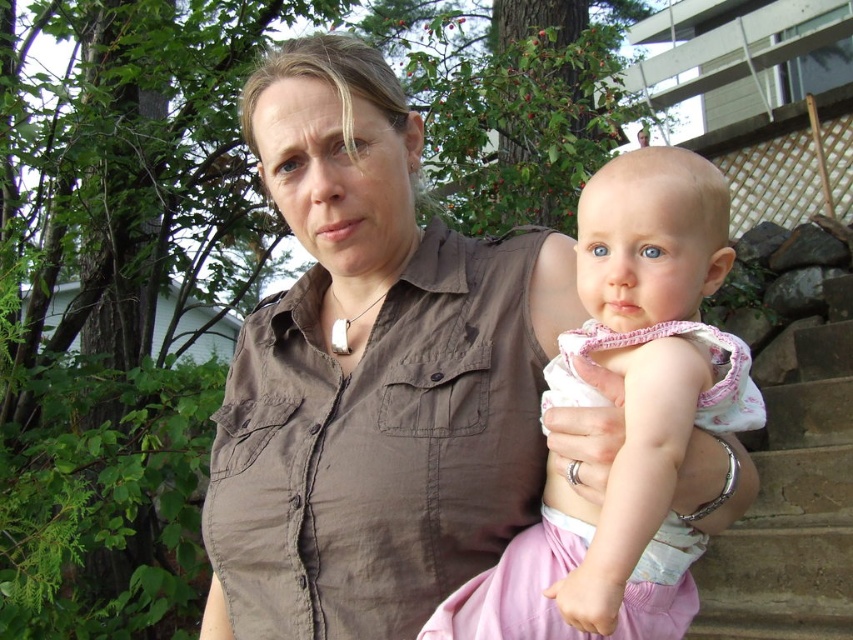
You are a photographer setting up for a family portrait. You need to place a pink fabric backdrop at center so it doesn not get hidden by other objects. Considering the brown stone stairs at lower right, will the pink fabric at center be visible behind the woman and baby?

The brown stone stairs at lower right is taller than the pink fabric at center, so the pink fabric at center will be visible behind the woman and baby because it is shorter than the stairs.

You are a photographer setting up for a family portrait. You notice the pink fabric baby at center and the silver metallic ring at center in the scene. Which object should you focus on first if you want to capture the larger object in your shot?

The pink fabric baby at center is bigger than the silver metallic ring at center, so you should focus on the pink fabric baby at center first to capture the larger object.